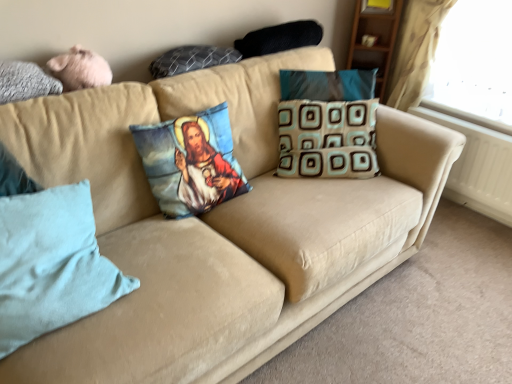
Question: From a real-world perspective, is black textured pillow at upper center, positioned as the first pillow in top-to-bottom order, beneath light blue fabric pillow at lower left, the 6th pillow viewed from the top?

Choices:
 (A) yes
 (B) no

Answer: (B)

Question: Is light blue fabric pillow at lower left, the 6th pillow viewed from the top, located within black textured pillow at upper center, positioned as the first pillow in top-to-bottom order?

Choices:
 (A) no
 (B) yes

Answer: (A)

Question: Is black textured pillow at upper center, the sixth pillow positioned from the bottom, directly adjacent to light blue fabric pillow at lower left, the 6th pillow viewed from the top?

Choices:
 (A) no
 (B) yes

Answer: (A)

Question: Considering the relative positions of black textured pillow at upper center, positioned as the first pillow in top-to-bottom order, and light blue fabric pillow at lower left, the 6th pillow viewed from the top, in the image provided, is black textured pillow at upper center, positioned as the first pillow in top-to-bottom order, to the left of light blue fabric pillow at lower left, the 6th pillow viewed from the top, from the viewer's perspective?

Choices:
 (A) no
 (B) yes

Answer: (A)

Question: Does black textured pillow at upper center, the sixth pillow positioned from the bottom, have a lesser height compared to light blue fabric pillow at lower left, which is the 1th pillow in bottom-to-top order?

Choices:
 (A) yes
 (B) no

Answer: (A)

Question: Is black textured pillow at upper center, positioned as the first pillow in top-to-bottom order, taller than light blue fabric pillow at lower left, the 6th pillow viewed from the top?

Choices:
 (A) no
 (B) yes

Answer: (A)

Question: Is translucent fabric at upper right placed right next to light blue fabric pillow at lower left, the 6th pillow viewed from the top?

Choices:
 (A) yes
 (B) no

Answer: (B)

Question: From a real-world perspective, is translucent fabric at upper right physically below light blue fabric pillow at lower left, which is the 1th pillow in bottom-to-top order?

Choices:
 (A) yes
 (B) no

Answer: (B)

Question: Considering the relative sizes of translucent fabric at upper right and light blue fabric pillow at lower left, which is the 1th pillow in bottom-to-top order, in the image provided, is translucent fabric at upper right smaller than light blue fabric pillow at lower left, which is the 1th pillow in bottom-to-top order,?

Choices:
 (A) yes
 (B) no

Answer: (B)

Question: Is translucent fabric at upper right further to camera compared to light blue fabric pillow at lower left, which is the 1th pillow in bottom-to-top order?

Choices:
 (A) yes
 (B) no

Answer: (A)

Question: From the image's perspective, is translucent fabric at upper right below light blue fabric pillow at lower left, the 6th pillow viewed from the top?

Choices:
 (A) yes
 (B) no

Answer: (B)

Question: Can you confirm if translucent fabric at upper right is positioned to the right of light blue fabric pillow at lower left, which is the 1th pillow in bottom-to-top order?

Choices:
 (A) yes
 (B) no

Answer: (A)

Question: Is light blue fabric pillow at lower left, which is the 1th pillow in bottom-to-top order, positioned before gray textured pillow at upper left, which is the 3th pillow from top to bottom?

Choices:
 (A) no
 (B) yes

Answer: (B)